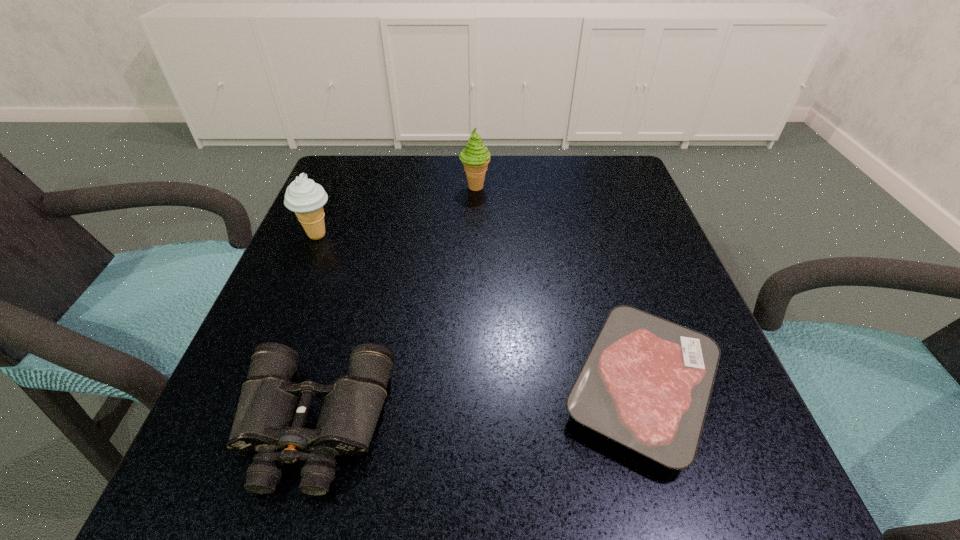
Image resolution: width=960 pixels, height=540 pixels. What are the coordinates of `object situated at the far edge` in the screenshot? It's located at (475, 157).

You are a GUI agent. You are given a task and a screenshot of the screen. Output one action in this format:
    pyautogui.click(x=<x>, y=<y>)
    Task: Click on the binoculars at the near edge
    
    Given the screenshot: What is the action you would take?
    pyautogui.click(x=272, y=411)

Where is `steak situated at the near edge`? The height and width of the screenshot is (540, 960). steak situated at the near edge is located at coordinates (646, 383).

The width and height of the screenshot is (960, 540). I want to click on icecream present at the left edge, so click(303, 196).

In order to click on binoculars that is at the left edge in this screenshot , I will do `click(272, 411)`.

In order to click on object present at the right edge in this screenshot , I will do pyautogui.click(x=646, y=383).

The width and height of the screenshot is (960, 540). Identify the location of object that is at the near left corner. (272, 411).

Find the location of a particular element. object present at the near right corner is located at coordinates 646,383.

In the image, there is a desktop. At what (x,y) coordinates should I click in order to perform the action: click on vacant space at the far edge. Please return your answer as a coordinate pair (x, y). This screenshot has height=540, width=960. Looking at the image, I should click on click(493, 156).

In the image, there is a desktop. At what (x,y) coordinates should I click in order to perform the action: click on vacant space at the near edge. Please return your answer as a coordinate pair (x, y). The height and width of the screenshot is (540, 960). Looking at the image, I should click on (626, 449).